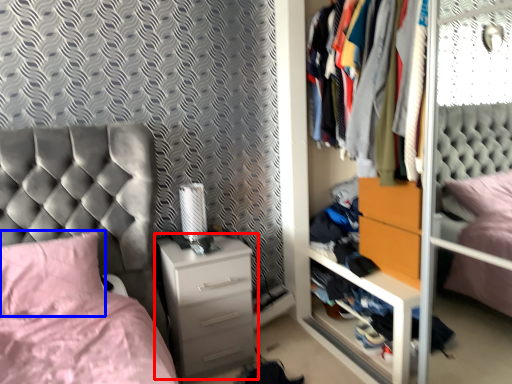
Question: Which point is further to the camera, chest of drawers (highlighted by a red box) or pillow (highlighted by a blue box)?

Choices:
 (A) chest of drawers
 (B) pillow

Answer: (A)